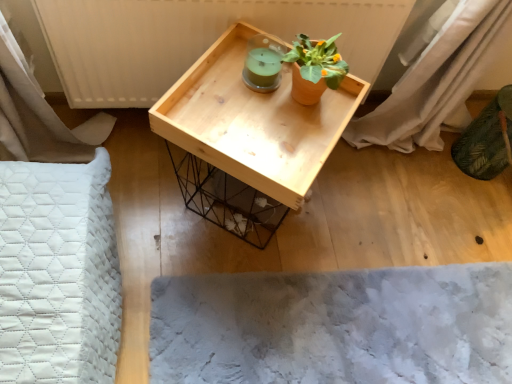
Locate an element on the screen. The image size is (512, 384). vacant space underneath fuzzy gray mat at lower center (from a real-world perspective) is located at coordinates (360, 326).